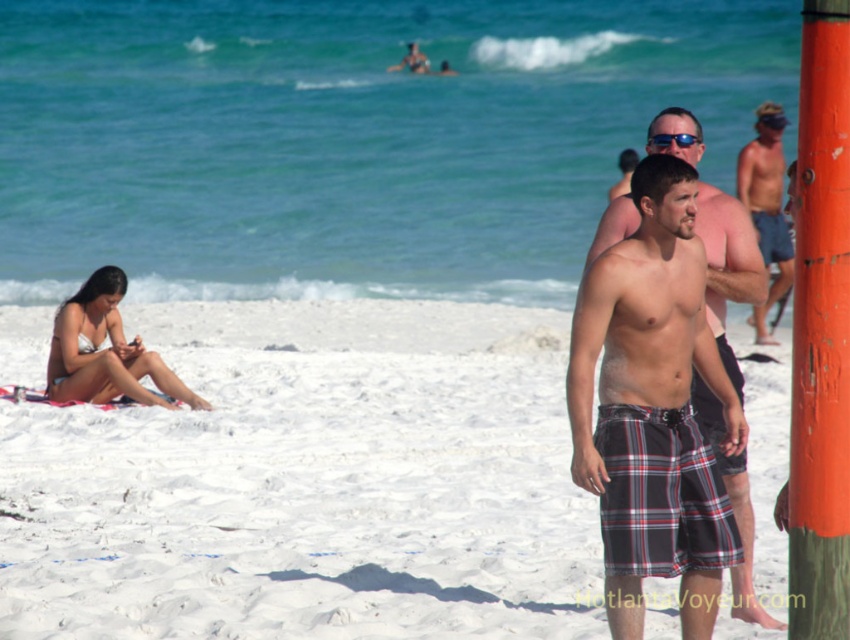
Is white sand at lower left behind orange painted wood post at right?

Yes.

Does white sand at lower left have a lesser height compared to orange painted wood post at right?

Yes, white sand at lower left is shorter than orange painted wood post at right.

In order to click on white sand at lower left in this screenshot , I will do `click(310, 483)`.

Does point (809, 316) lie in front of point (94, 296)?

Yes, point (809, 316) is closer to viewer.

The width and height of the screenshot is (850, 640). What do you see at coordinates (820, 333) in the screenshot?
I see `orange painted wood post at right` at bounding box center [820, 333].

In order to click on orange painted wood post at right in this screenshot , I will do [820, 333].

Can you confirm if white sand at lower left is bigger than plaid shorts at center?

Correct, white sand at lower left is larger in size than plaid shorts at center.

Where is `white sand at lower left`? Image resolution: width=850 pixels, height=640 pixels. white sand at lower left is located at coordinates (310, 483).

This screenshot has height=640, width=850. In order to click on white sand at lower left in this screenshot , I will do `click(310, 483)`.